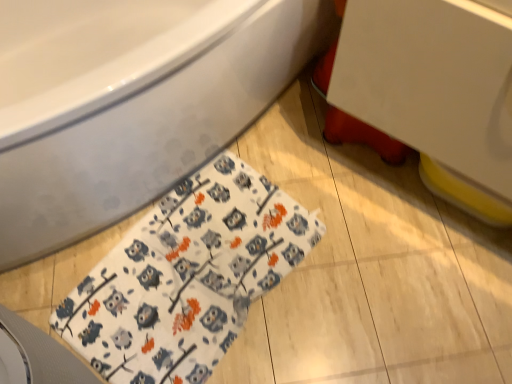
Locate an element on the screen. The height and width of the screenshot is (384, 512). white glossy bathtub at upper left is located at coordinates (148, 120).

What is the approximate height of white glossy sink at upper right?

It is 18.87 inches.

At what (x,y) coordinates should I click in order to perform the action: click on white fabric with owl pattern at lower left. Please return your answer as a coordinate pair (x, y). Looking at the image, I should click on (187, 276).

Is white fabric with owl pattern at lower left looking in the opposite direction of white glossy bathtub at upper left?

Yes, white fabric with owl pattern at lower left is facing away from white glossy bathtub at upper left.

Which of these two, white fabric with owl pattern at lower left or white glossy bathtub at upper left, is thinner?

Thinner between the two is white fabric with owl pattern at lower left.

Is white fabric with owl pattern at lower left at the left side of white glossy bathtub at upper left?

No.

From a real-world perspective, relative to white glossy bathtub at upper left, is white fabric with owl pattern at lower left vertically above or below?

Clearly, from a real-world perspective, white fabric with owl pattern at lower left is below white glossy bathtub at upper left.

This screenshot has width=512, height=384. There is a white glossy bathtub at upper left. In order to click on sink above it (from a real-world perspective) in this screenshot , I will do `click(436, 92)`.

Is white glossy bathtub at upper left taller or shorter than white glossy sink at upper right?

Considering their sizes, white glossy bathtub at upper left has more height than white glossy sink at upper right.

Looking at their sizes, would you say white glossy bathtub at upper left is wider or thinner than white glossy sink at upper right?

white glossy bathtub at upper left is wider than white glossy sink at upper right.

Does white glossy bathtub at upper left contain white glossy sink at upper right?

No, white glossy sink at upper right is located outside of white glossy bathtub at upper left.

From the image's perspective, which is above, white fabric with owl pattern at lower left or white glossy sink at upper right?

white glossy sink at upper right.

Are white fabric with owl pattern at lower left and white glossy sink at upper right beside each other?

No, white fabric with owl pattern at lower left is not making contact with white glossy sink at upper right.

From a real-world perspective, between white fabric with owl pattern at lower left and white glossy sink at upper right, who is vertically higher?

white glossy sink at upper right is physically above.

Which is more to the left, white fabric with owl pattern at lower left or white glossy sink at upper right?

white fabric with owl pattern at lower left is more to the left.

Considering the relative sizes of white glossy sink at upper right and white glossy bathtub at upper left in the image provided, is white glossy sink at upper right taller than white glossy bathtub at upper left?

Incorrect, the height of white glossy sink at upper right is not larger of that of white glossy bathtub at upper left.

Are white glossy sink at upper right and white glossy bathtub at upper left making contact?

No, white glossy sink at upper right is not next to white glossy bathtub at upper left.

From the image's perspective, is white glossy sink at upper right above or below white glossy bathtub at upper left?

Clearly, from the image's perspective, white glossy sink at upper right is below white glossy bathtub at upper left.

Is white glossy sink at upper right at the right side of white glossy bathtub at upper left?

Yes.

Consider the image. Which object is positioned more to the left, white glossy bathtub at upper left or white fabric with owl pattern at lower left?

From the viewer's perspective, white glossy bathtub at upper left appears more on the left side.

Find the location of `blanket below the white glossy bathtub at upper left (from a real-world perspective)`. blanket below the white glossy bathtub at upper left (from a real-world perspective) is located at coordinates (187, 276).

From the image's perspective, does white glossy bathtub at upper left appear higher than white fabric with owl pattern at lower left?

Yes, from the image's perspective, white glossy bathtub at upper left is over white fabric with owl pattern at lower left.

Which is less distant, (126, 111) or (290, 262)?

Point (126, 111) is positioned closer to the camera compared to point (290, 262).

From a real-world perspective, which object stands above the other?

white glossy sink at upper right, from a real-world perspective.

Which point is more distant from viewer, [361,49] or [221,291]?

Positioned behind is point [221,291].

Would you say white glossy sink at upper right is a long distance from white fabric with owl pattern at lower left?

No, white glossy sink at upper right is not far away from white fabric with owl pattern at lower left.

Does white glossy sink at upper right have a greater width compared to white fabric with owl pattern at lower left?

Incorrect, the width of white glossy sink at upper right does not surpass that of white fabric with owl pattern at lower left.

At what (x,y) coordinates should I click in order to perform the action: click on bathtub located above the white fabric with owl pattern at lower left (from a real-world perspective). Please return your answer as a coordinate pair (x, y). This screenshot has height=384, width=512. Looking at the image, I should click on (148, 120).

You are a GUI agent. You are given a task and a screenshot of the screen. Output one action in this format:
    pyautogui.click(x=<x>, y=<y>)
    Task: Click on the bathtub behind the white glossy sink at upper right
    
    Given the screenshot: What is the action you would take?
    pyautogui.click(x=148, y=120)

Considering their positions, is white glossy bathtub at upper left positioned further to white glossy sink at upper right than white fabric with owl pattern at lower left?

white fabric with owl pattern at lower left.

Considering their positions, is white fabric with owl pattern at lower left positioned closer to white glossy bathtub at upper left than white glossy sink at upper right?

The object closer to white glossy bathtub at upper left is white fabric with owl pattern at lower left.

Looking at the image, which one is located closer to white fabric with owl pattern at lower left, white glossy sink at upper right or white glossy bathtub at upper left?

Among the two, white glossy bathtub at upper left is located nearer to white fabric with owl pattern at lower left.

Looking at this image, considering their positions, is white glossy sink at upper right positioned closer to white glossy bathtub at upper left than white fabric with owl pattern at lower left?

The object closer to white glossy bathtub at upper left is white fabric with owl pattern at lower left.

Considering their positions, is white fabric with owl pattern at lower left positioned further to white glossy sink at upper right than white glossy bathtub at upper left?

white fabric with owl pattern at lower left is positioned further to the anchor white glossy sink at upper right.

When comparing their distances from white fabric with owl pattern at lower left, does white glossy bathtub at upper left or white glossy sink at upper right seem further?

white glossy sink at upper right.

Identify the location of blanket located between white glossy bathtub at upper left and white glossy sink at upper right in the left-right direction. Image resolution: width=512 pixels, height=384 pixels. (187, 276).